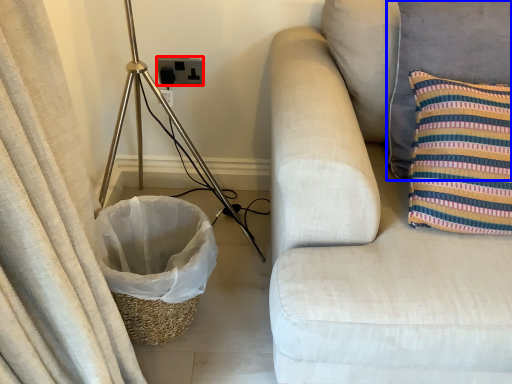
Question: Which point is closer to the camera, electric outlet (highlighted by a red box) or pillow (highlighted by a blue box)?

Choices:
 (A) electric outlet
 (B) pillow

Answer: (B)